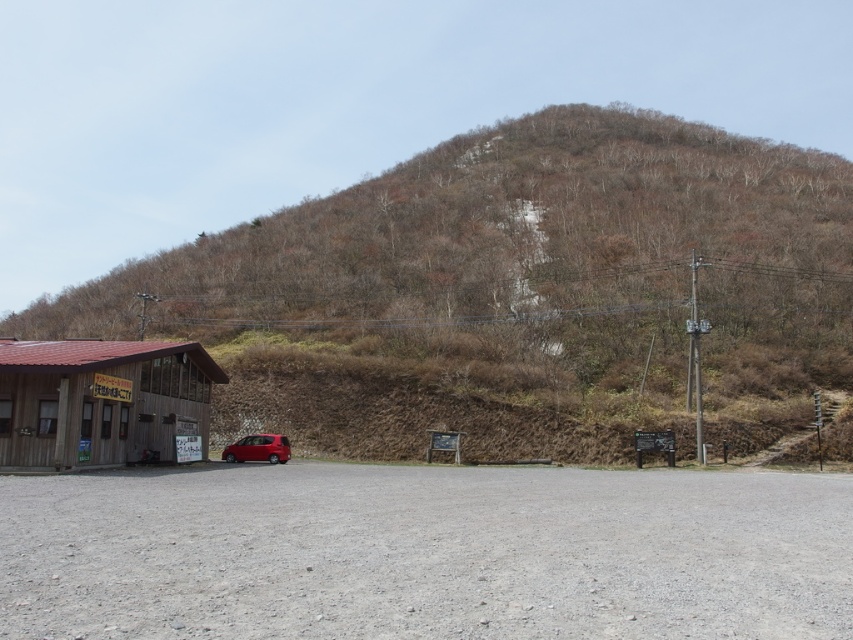
Question: Among these objects, which one is farthest from the camera?

Choices:
 (A) brown wooden building at lower left
 (B) shiny red car at lower center
 (C) brown wooden hut at lower left

Answer: (A)

Question: Which of the following is the closest to the observer?

Choices:
 (A) (827, 244)
 (B) (109, 404)
 (C) (247, 435)

Answer: (B)

Question: Can you confirm if brown wooden hut at lower left is positioned below shiny red car at lower center?

Choices:
 (A) yes
 (B) no

Answer: (B)

Question: Among these objects, which one is nearest to the camera?

Choices:
 (A) brown wooden hut at lower left
 (B) brown wooden building at lower left
 (C) shiny red car at lower center

Answer: (A)

Question: From the image, what is the correct spatial relationship of brown wooden building at lower left in relation to brown wooden hut at lower left?

Choices:
 (A) below
 (B) above

Answer: (B)

Question: From the image, what is the correct spatial relationship of brown wooden building at lower left in relation to brown wooden hut at lower left?

Choices:
 (A) below
 (B) above

Answer: (B)